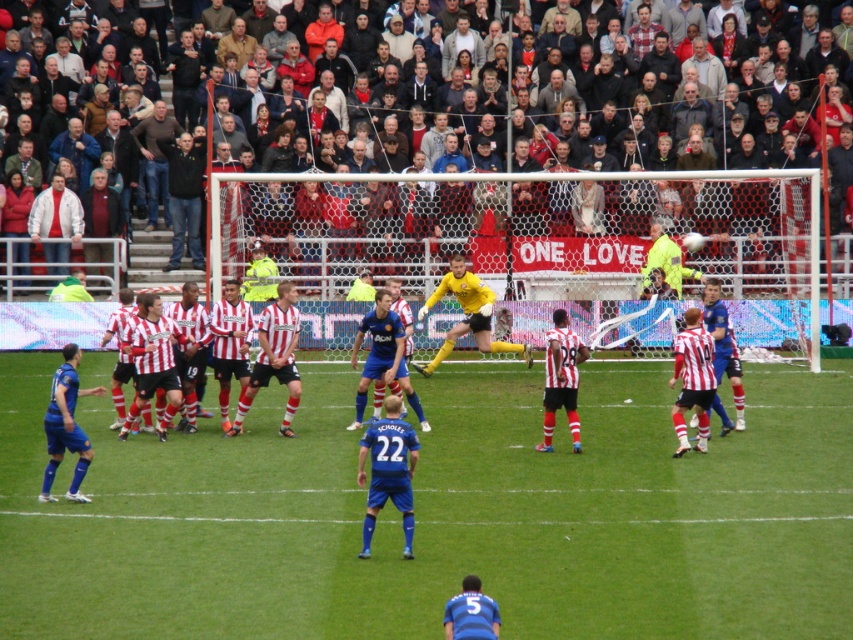
Question: Where is yellow matte football at center located in relation to matte red and white jersey at center in the image?

Choices:
 (A) left
 (B) right

Answer: (A)

Question: Is dark green jacket at upper left bigger than matte red and white jersey at center?

Choices:
 (A) no
 (B) yes

Answer: (B)

Question: Which point appears farthest from the camera in this image?

Choices:
 (A) (558, 316)
 (B) (321, 442)
 (C) (421, 243)

Answer: (C)

Question: Does striped jersey players at center appear over matte red and white jersey at center?

Choices:
 (A) no
 (B) yes

Answer: (A)

Question: Which is nearer to the dark green jacket at upper left?

Choices:
 (A) yellow smooth net at center
 (B) striped jersey players at center
 (C) green grass football field at center
 (D) matte red and white jersey at center

Answer: (A)

Question: Estimate the real-world distances between objects in this image. Which object is farther from the yellow matte football at center?

Choices:
 (A) brown leather jacket at upper center
 (B) green grass football field at center

Answer: (A)